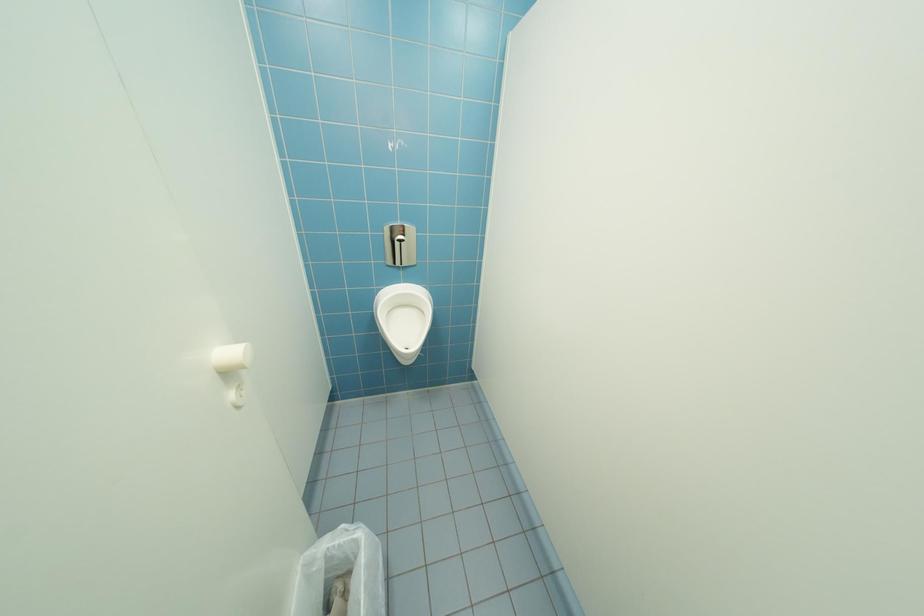
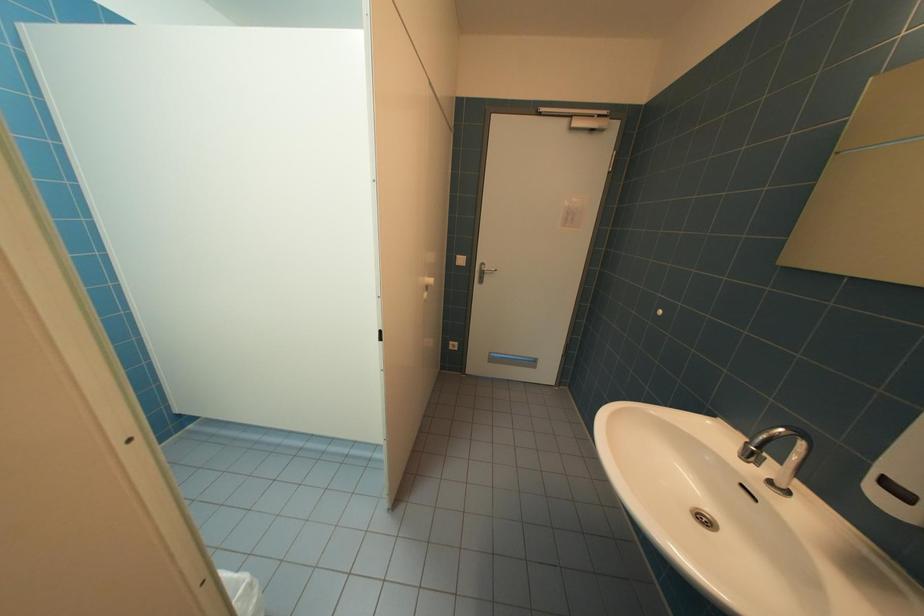
Question: Based on the continuous images, in which direction is the camera rotating? Reply with the corresponding letter.

Choices:
 (A) Left
 (B) Right
 (C) Up
 (D) Down

Answer: (B)